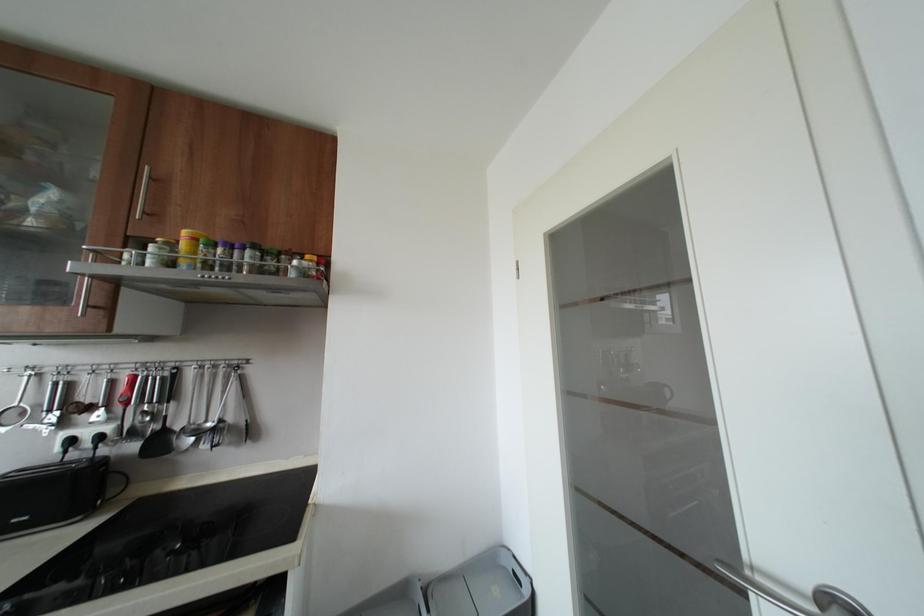
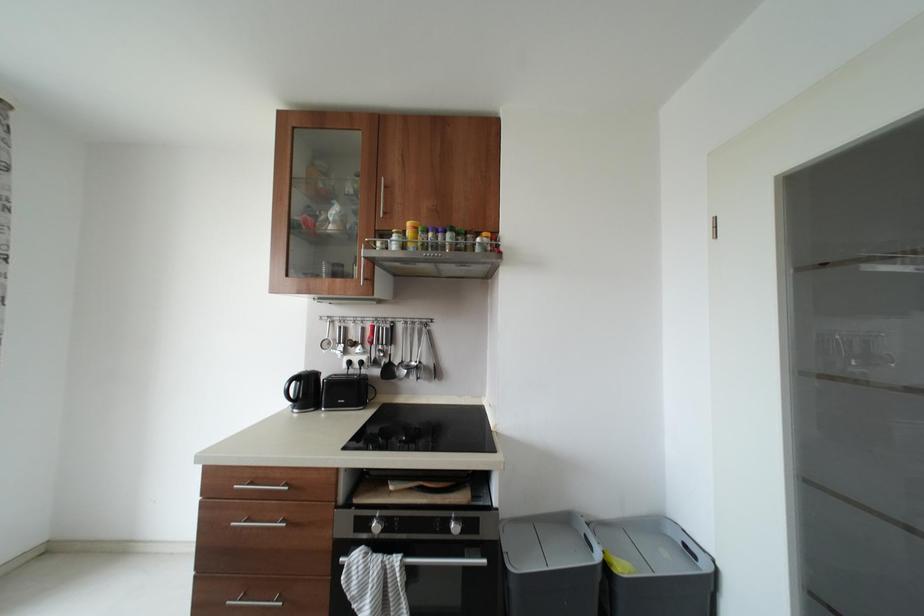
Question: The camera is either moving clockwise (left) or counter-clockwise (right) around the object. The first image is from the beginning of the video and the second image is from the end. Is the camera moving left or right when shooting the video?

Choices:
 (A) Left
 (B) Right

Answer: (B)